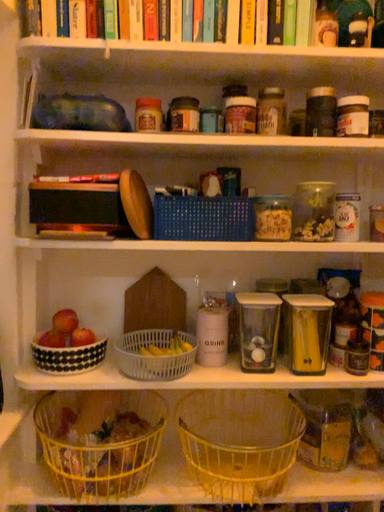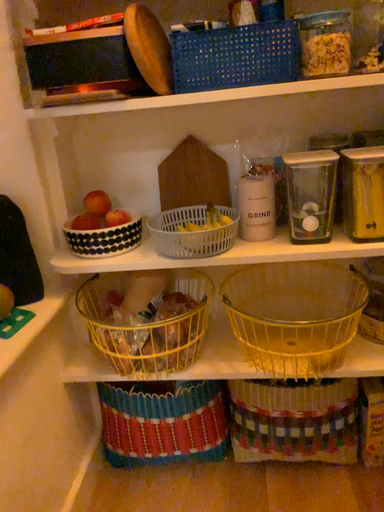
Question: How did the camera likely rotate when shooting the video?

Choices:
 (A) rotated left
 (B) rotated right

Answer: (A)